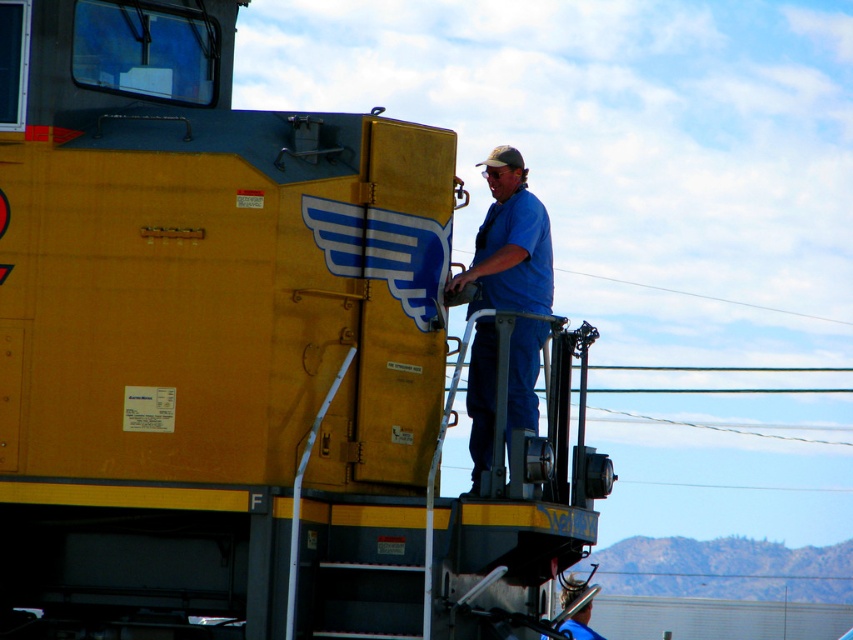
Question: Which of the following is the closest to the observer?

Choices:
 (A) yellow matte train at center
 (B) blue cotton shirt at center

Answer: (A)

Question: Can you confirm if yellow matte train at center is positioned above blue cotton shirt at center?

Choices:
 (A) yes
 (B) no

Answer: (B)

Question: Can you confirm if yellow matte train at center is wider than blue cotton shirt at center?

Choices:
 (A) yes
 (B) no

Answer: (A)

Question: Is yellow matte train at center positioned behind blue cotton shirt at center?

Choices:
 (A) no
 (B) yes

Answer: (A)

Question: Which object is closer to the camera taking this photo?

Choices:
 (A) blue cotton shirt at center
 (B) yellow matte train at center

Answer: (B)

Question: Among these points, which one is farthest from the camera?

Choices:
 (A) (514, 168)
 (B) (447, 413)

Answer: (A)